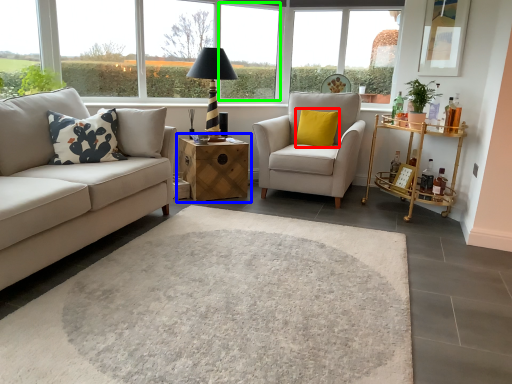
Question: Which is nearer to the pillow (highlighted by a red box)? table (highlighted by a blue box) or window frame (highlighted by a green box).

Choices:
 (A) table
 (B) window frame

Answer: (A)